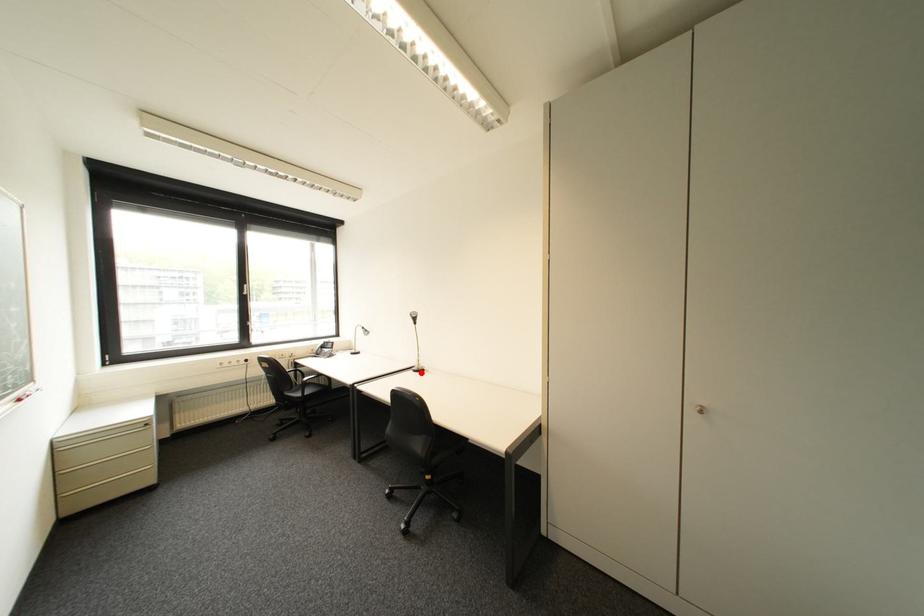
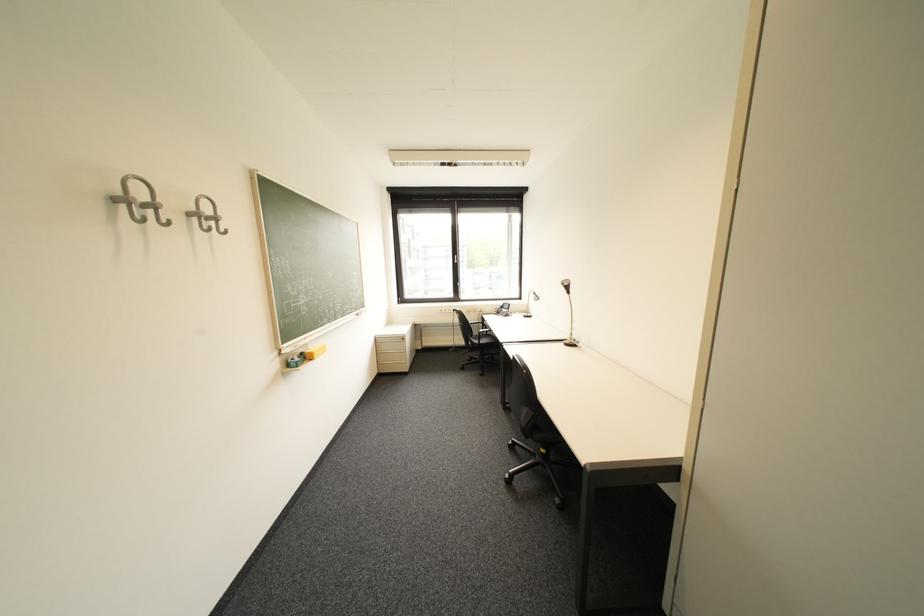
Find the pixel in the second image that matches the highlighted location in the first image.

(572, 345)